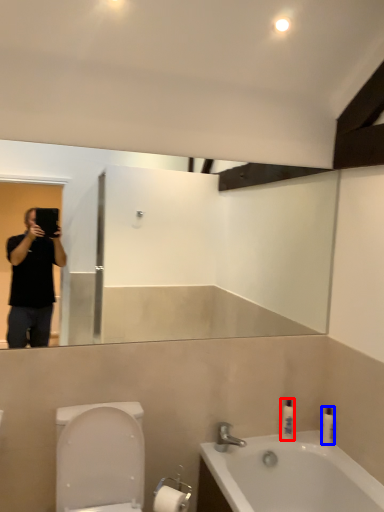
Question: Which of the following is the closest to the observer, toiletry (highlighted by a red box) or toiletry (highlighted by a blue box)?

Choices:
 (A) toiletry
 (B) toiletry

Answer: (B)